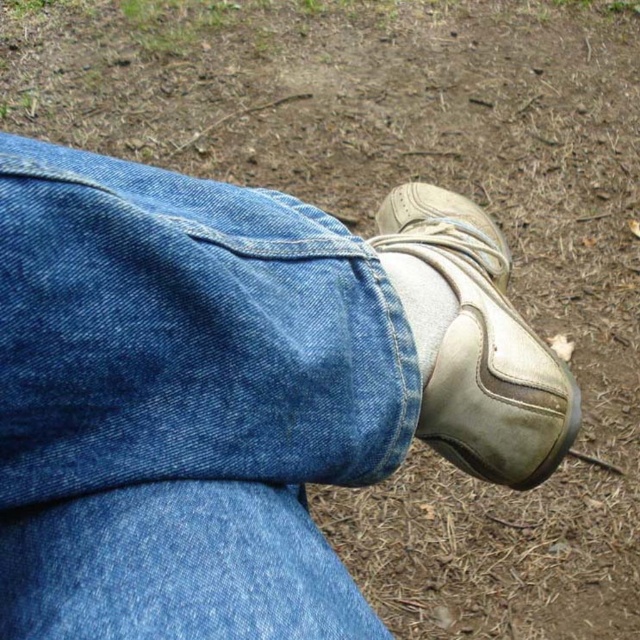
Does denim at lower right lie behind white leather shoe at lower center?

No, it is not.

Is point (70, 468) positioned in front of point (420, 225)?

Yes.

You are a GUI agent. You are given a task and a screenshot of the screen. Output one action in this format:
    pyautogui.click(x=<x>, y=<y>)
    Task: Click on the denim at lower right
    
    Given the screenshot: What is the action you would take?
    pyautogui.click(x=182, y=403)

Find the location of a particular element. The width and height of the screenshot is (640, 640). denim at lower right is located at coordinates (182, 403).